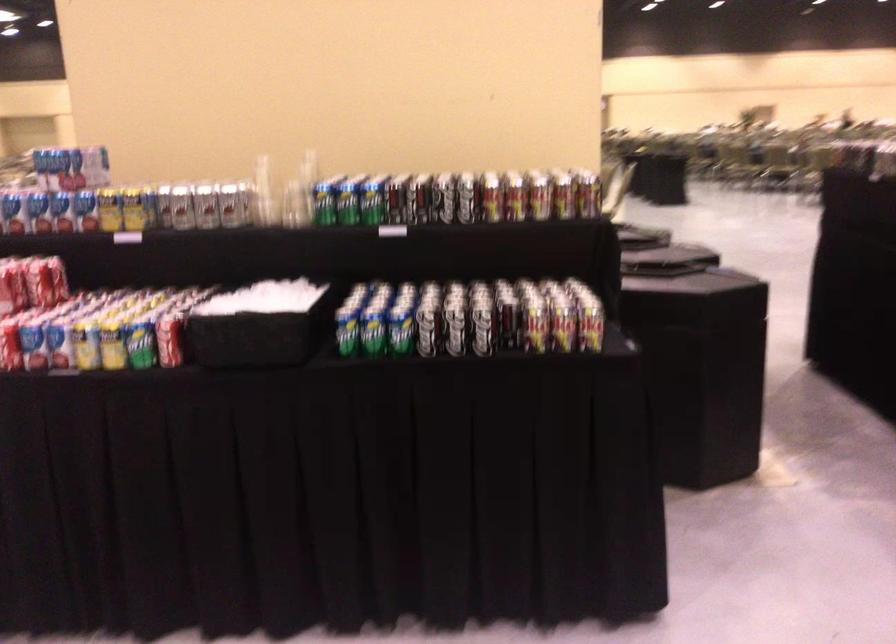
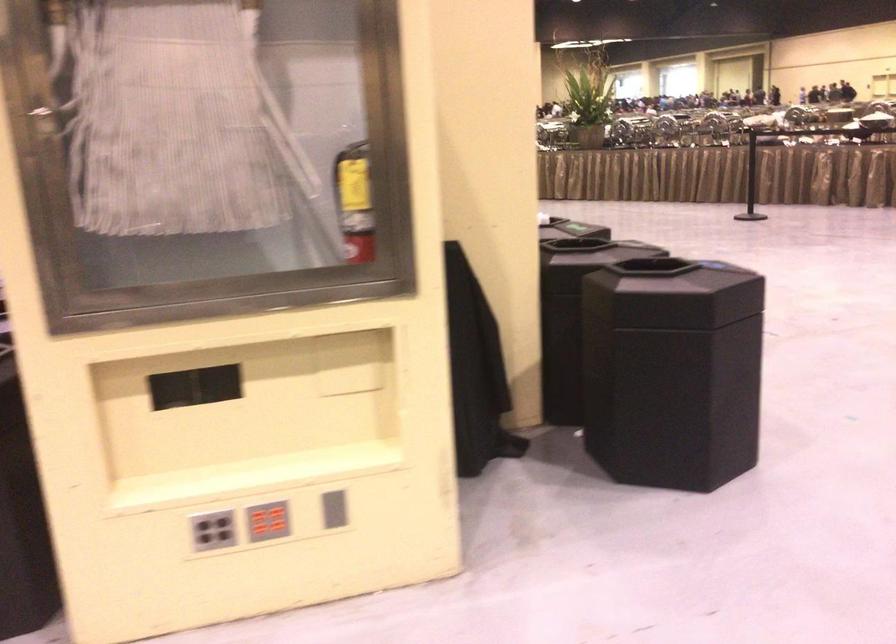
Question: I am providing you with two images of the same scene from different viewpoints. Which of the following objects are not visible in image2?

Choices:
 (A) green soda can
 (B) grey button panel
 (C) grey vertical slot
 (D) green toy handle

Answer: (A)